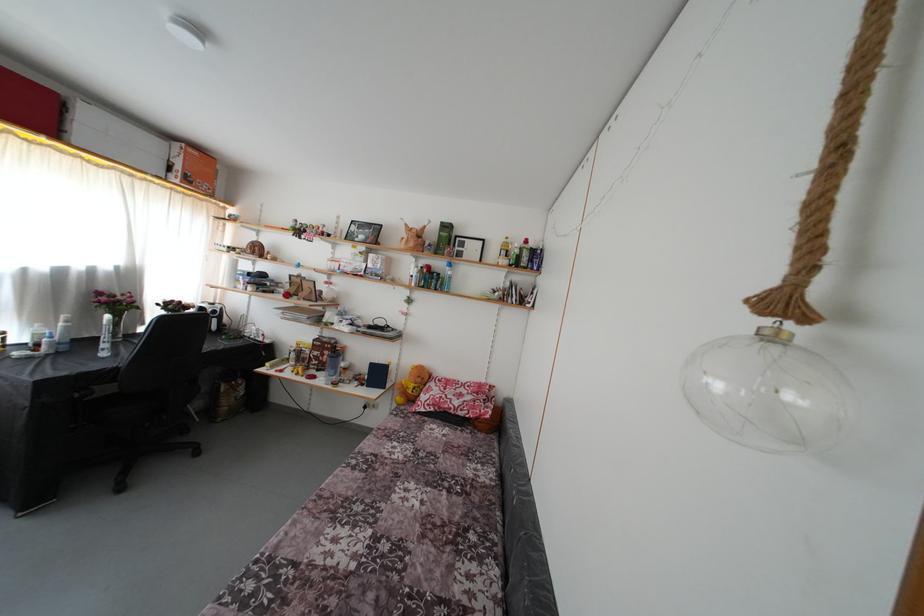
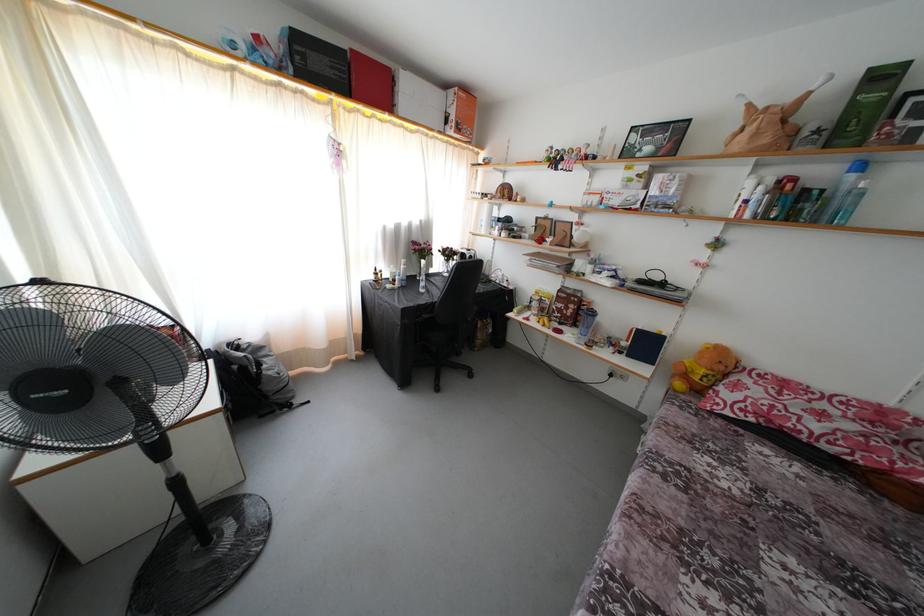
In the second image, find the point that corresponds to point (451, 270) in the first image.

(849, 172)